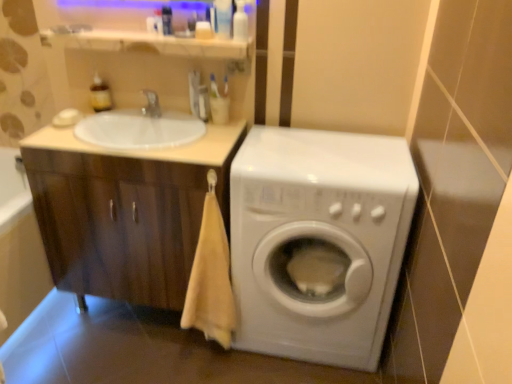
Question: Considering their positions, is translucent plastic bottle at upper center, marked as the fifth toiletry in a left-to-right arrangement, located in front of or behind translucent amber bottle at upper left, arranged as the sixth toiletry when viewed from the right?

Choices:
 (A) front
 (B) behind

Answer: (A)

Question: From the image's perspective, is translucent plastic bottle at upper center, marked as the fifth toiletry in a left-to-right arrangement, positioned above or below translucent amber bottle at upper left, arranged as the sixth toiletry when viewed from the right?

Choices:
 (A) below
 (B) above

Answer: (B)

Question: Which object is positioned farthest from the translucent plastic bottle at upper center, marked as the fifth toiletry in a left-to-right arrangement?

Choices:
 (A) translucent plastic toothbrush at upper center, the fourth toiletry when ordered from left to right
 (B) white glossy sink at upper left
 (C) translucent plastic toothbrush at upper center, which is counted as the fourth toiletry, starting from the right
 (D) white glossy tap at upper center
 (E) wooden cabinet at lower left

Answer: (E)

Question: Estimate the real-world distances between objects in this image. Which object is farther from the beige cotton towel at lower left?

Choices:
 (A) translucent amber bottle at upper left, arranged as the sixth toiletry when viewed from the right
 (B) translucent plastic bottle at upper center, the second toiletry positioned from the right
 (C) wooden cabinet at left
 (D) white matte soap at upper left, which is the second soap in bottom-to-top order
 (E) wooden cabinet at lower left

Answer: (A)